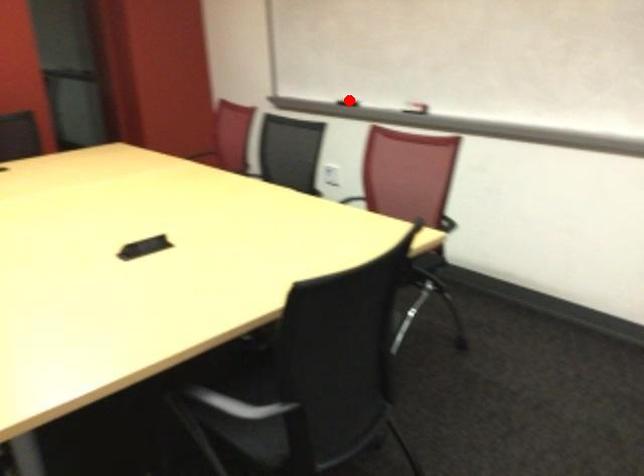
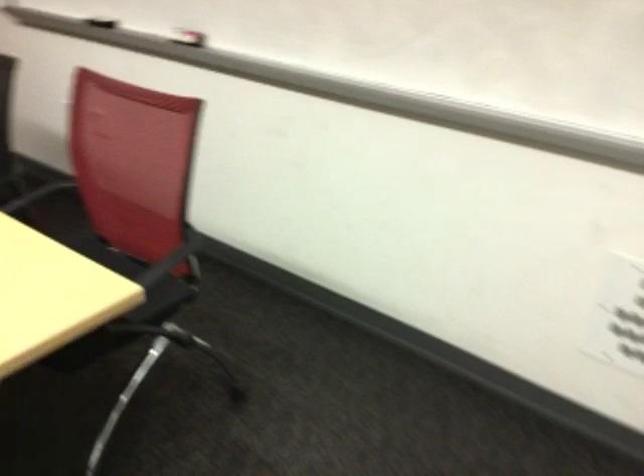
Question: I am providing you with two images of the same scene from different viewpoints. A red point is shown in image1. For the corresponding object point in image2, is it positioned nearer or farther from the camera?

Choices:
 (A) Nearer
 (B) Farther

Answer: (A)